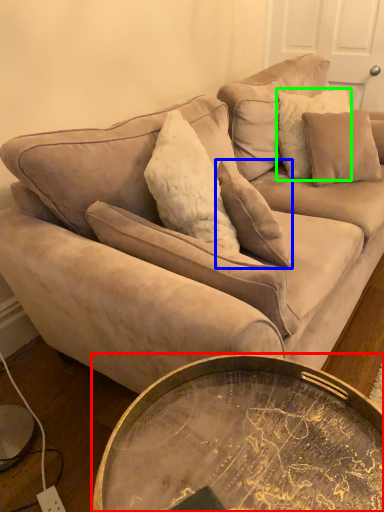
Question: Estimate the real-world distances between objects in this image. Which object is farther from coffee table (highlighted by a red box), pillow (highlighted by a blue box) or pillow (highlighted by a green box)?

Choices:
 (A) pillow
 (B) pillow

Answer: (B)